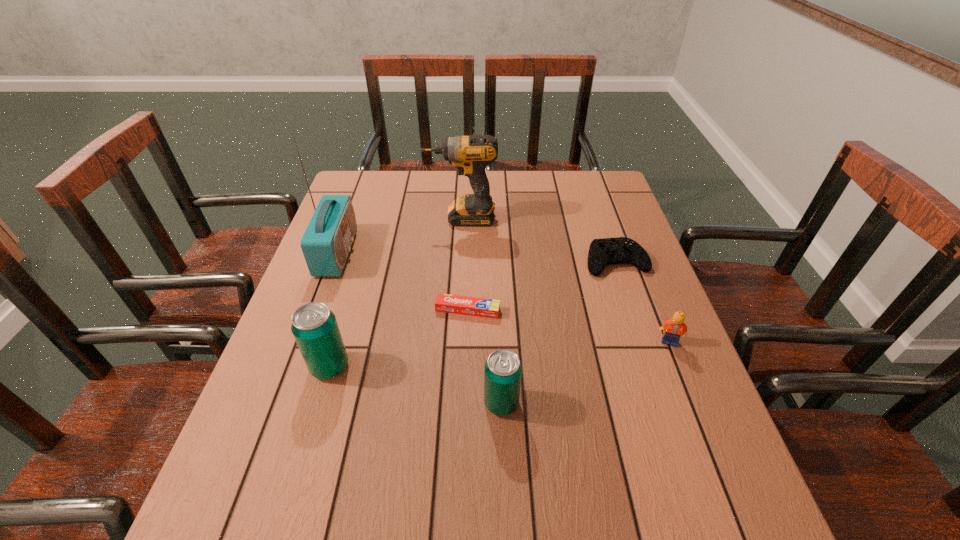
Find the location of a particular element. unoccupied area between the shortest object and the nearest object is located at coordinates (485, 356).

Identify the location of free space between the sixth shortest object and the control. (539, 240).

Select which object appears as the fourth closest to the toothpaste. Please provide its 2D coordinates. Your answer should be formatted as a tuple, i.e. [(x, y)], where the tuple contains the x and y coordinates of a point satisfying the conditions above.

[(326, 243)]

At what (x,y) coordinates should I click in order to perform the action: click on object that is the sixth closest to the tallest object. Please return your answer as a coordinate pair (x, y). Looking at the image, I should click on (675, 328).

Image resolution: width=960 pixels, height=540 pixels. Identify the location of free location that satisfies the following two spatial constraints: 1. with the drill bit of the control facing forward; 2. on the left side of the drill. (459, 261).

Identify the location of vacant space that satisfies the following two spatial constraints: 1. on the front panel of the radio receiver; 2. on the left side of the fifth shortest object. (295, 366).

Where is `vacant space that satisfies the following two spatial constraints: 1. with the drill bit of the drill facing forward; 2. on the back side of the control`? This screenshot has height=540, width=960. vacant space that satisfies the following two spatial constraints: 1. with the drill bit of the drill facing forward; 2. on the back side of the control is located at coordinates (459, 261).

Where is `free space that satisfies the following two spatial constraints: 1. with the drill bit of the drill facing forward; 2. on the back side of the shortest object`? This screenshot has width=960, height=540. free space that satisfies the following two spatial constraints: 1. with the drill bit of the drill facing forward; 2. on the back side of the shortest object is located at coordinates (456, 310).

The width and height of the screenshot is (960, 540). Identify the location of blank space that satisfies the following two spatial constraints: 1. on the back side of the shortest object; 2. on the left side of the second nearest object. point(347,310).

Locate an element on the screen. This screenshot has width=960, height=540. blank area in the image that satisfies the following two spatial constraints: 1. on the front panel of the radio receiver; 2. on the left side of the farther beer can is located at coordinates (295, 366).